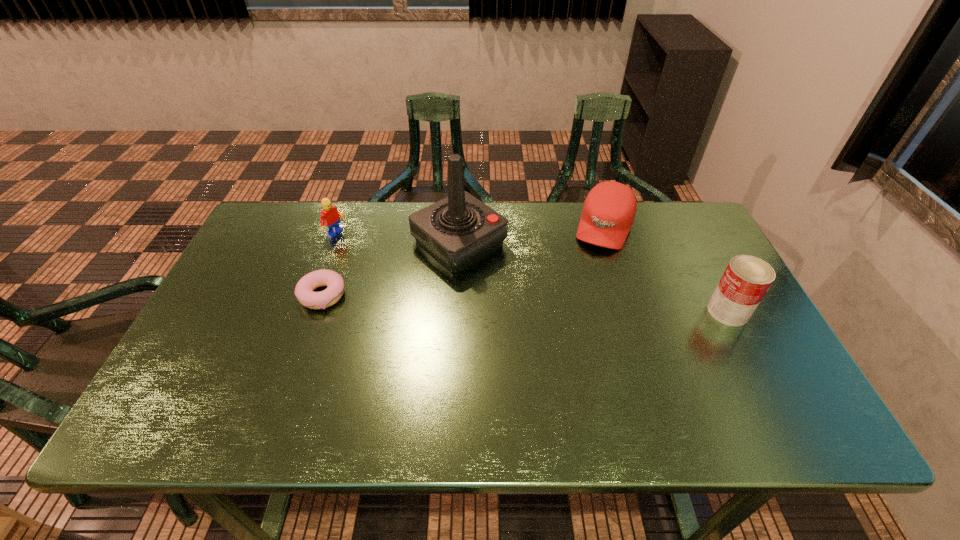
The width and height of the screenshot is (960, 540). Find the location of `object at the right edge`. object at the right edge is located at coordinates (746, 280).

What are the coordinates of `vacant space at the far edge of the desktop` in the screenshot? It's located at (410, 206).

This screenshot has height=540, width=960. What are the coordinates of `vacant region at the near edge of the desktop` in the screenshot? It's located at pyautogui.click(x=651, y=375).

The height and width of the screenshot is (540, 960). I want to click on free spot at the left edge of the desktop, so click(x=203, y=351).

Identify the location of vacant region at the right edge. This screenshot has width=960, height=540. (729, 347).

This screenshot has width=960, height=540. Find the location of `blank area at the far left corner`. blank area at the far left corner is located at coordinates (282, 217).

Locate an element on the screen. vacant space at the far right corner of the desktop is located at coordinates (666, 219).

Locate an element on the screen. The width and height of the screenshot is (960, 540). free spot between the Lego and the second tallest object is located at coordinates (533, 273).

The image size is (960, 540). In order to click on free space between the cap and the can in this screenshot , I will do `click(666, 269)`.

Locate an element on the screen. The width and height of the screenshot is (960, 540). unoccupied position between the Lego and the doughnut is located at coordinates (329, 266).